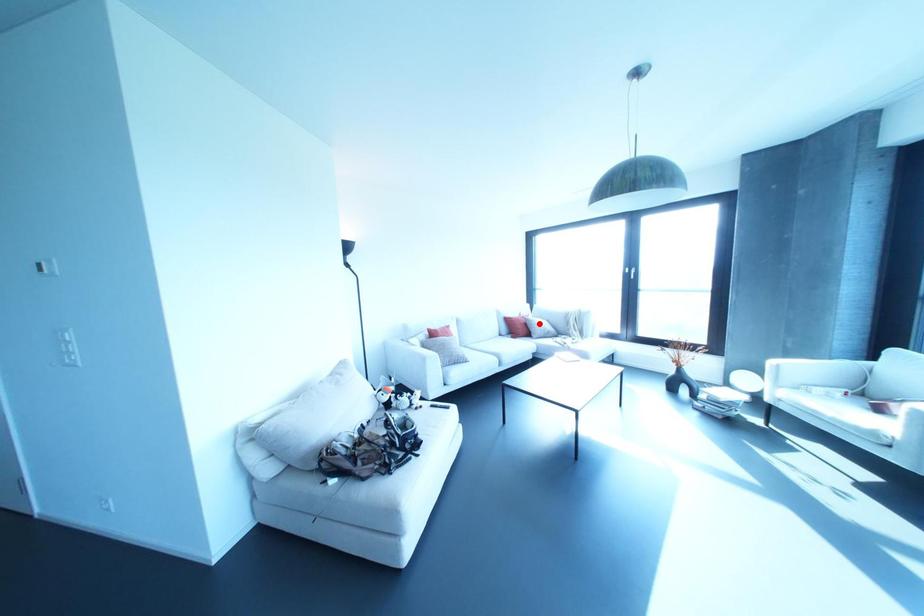
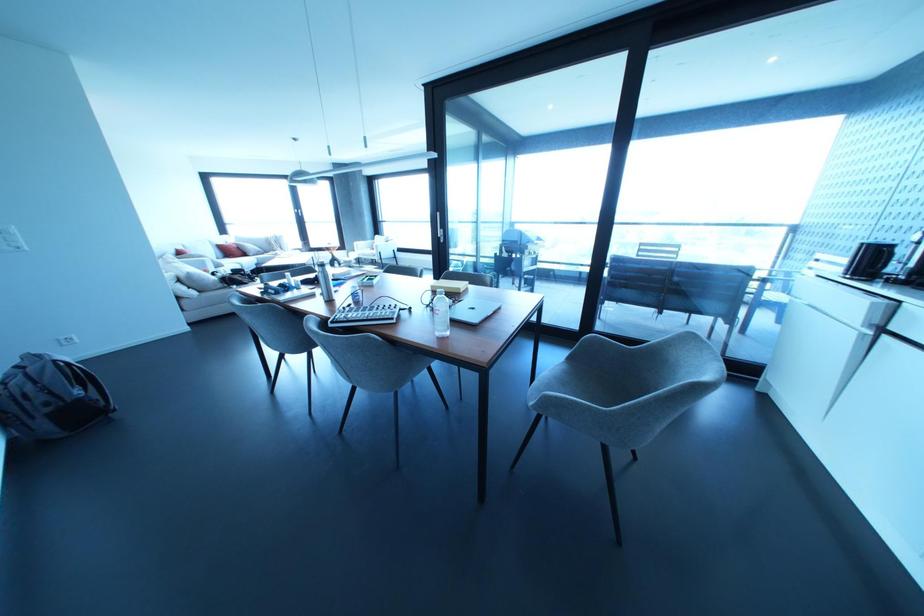
Question: I am providing you with two images of the same scene from different viewpoints. In image1, a red point is highlighted. Considering the same 3D point in image2, which of the following is correct?

Choices:
 (A) It is closer
 (B) It is farther

Answer: (A)